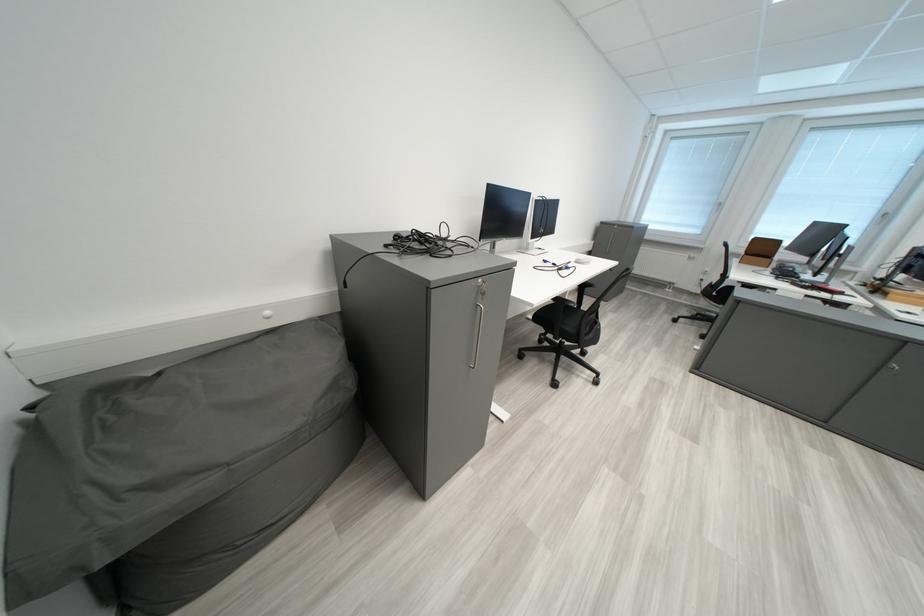
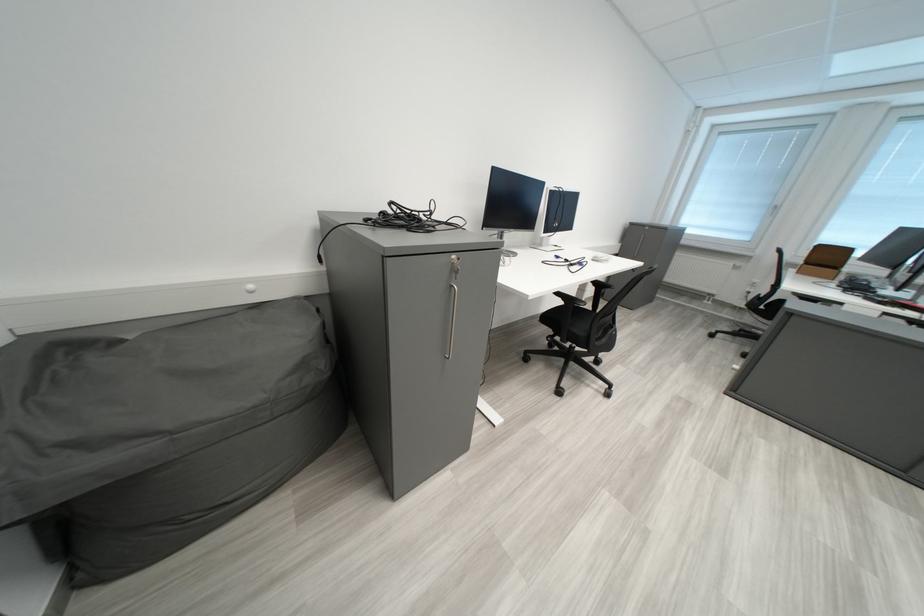
Locate, in the second image, the point that corresponds to (x=769, y=241) in the first image.

(833, 249)